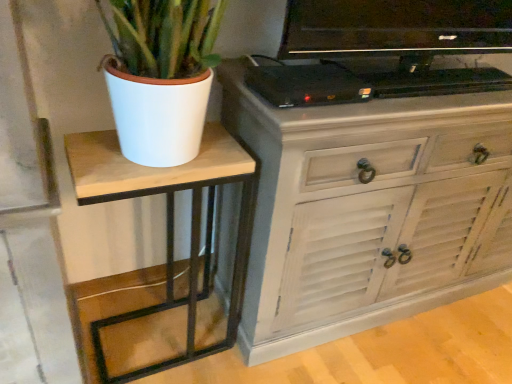
Question: From the image's perspective, does black plastic device at upper center appear lower than distressed white cabinet at center?

Choices:
 (A) no
 (B) yes

Answer: (A)

Question: Considering the relative positions of black plastic device at upper center and distressed white cabinet at center in the image provided, is black plastic device at upper center to the right of distressed white cabinet at center from the viewer's perspective?

Choices:
 (A) no
 (B) yes

Answer: (A)

Question: Considering the relative sizes of black plastic device at upper center and distressed white cabinet at center in the image provided, is black plastic device at upper center bigger than distressed white cabinet at center?

Choices:
 (A) yes
 (B) no

Answer: (B)

Question: Considering the relative sizes of black plastic device at upper center and distressed white cabinet at center in the image provided, is black plastic device at upper center wider than distressed white cabinet at center?

Choices:
 (A) no
 (B) yes

Answer: (A)

Question: Is black plastic device at upper center outside distressed white cabinet at center?

Choices:
 (A) no
 (B) yes

Answer: (B)

Question: From a real-world perspective, is distressed white cabinet at center above or below black glossy television at upper center?

Choices:
 (A) above
 (B) below

Answer: (B)

Question: Do you think distressed white cabinet at center is within black glossy television at upper center, or outside of it?

Choices:
 (A) outside
 (B) inside

Answer: (A)

Question: In the image, is distressed white cabinet at center positioned in front of or behind black glossy television at upper center?

Choices:
 (A) behind
 (B) front

Answer: (A)

Question: In terms of width, does distressed white cabinet at center look wider or thinner when compared to black glossy television at upper center?

Choices:
 (A) thin
 (B) wide

Answer: (B)

Question: Considering their positions, is wooden table at left located in front of or behind distressed white cabinet at center?

Choices:
 (A) front
 (B) behind

Answer: (B)

Question: Based on their positions, is wooden table at left located to the left or right of distressed white cabinet at center?

Choices:
 (A) left
 (B) right

Answer: (A)

Question: From a real-world perspective, is wooden table at left above or below distressed white cabinet at center?

Choices:
 (A) above
 (B) below

Answer: (B)

Question: In terms of width, does wooden table at left look wider or thinner when compared to distressed white cabinet at center?

Choices:
 (A) wide
 (B) thin

Answer: (B)

Question: Considering the positions of point (206, 233) and point (425, 36), is point (206, 233) closer or farther from the camera than point (425, 36)?

Choices:
 (A) closer
 (B) farther

Answer: (B)

Question: Considering the positions of wooden table at left and black glossy television at upper center in the image, is wooden table at left taller or shorter than black glossy television at upper center?

Choices:
 (A) tall
 (B) short

Answer: (A)